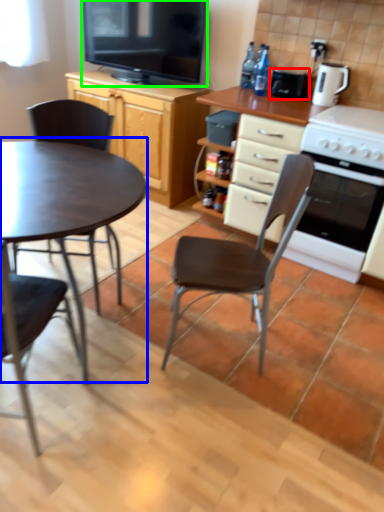
Question: Considering the real-world distances, which object is farthest from appliance (highlighted by a red box)? coffee table (highlighted by a blue box) or television (highlighted by a green box)?

Choices:
 (A) coffee table
 (B) television

Answer: (A)